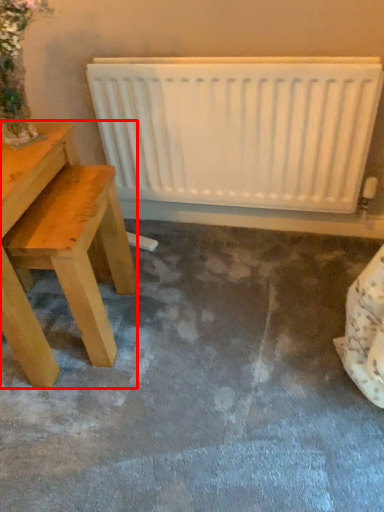
Question: Observing the image, what is the correct spatial positioning of table (annotated by the red box) in reference to radiator?

Choices:
 (A) left
 (B) right

Answer: (A)